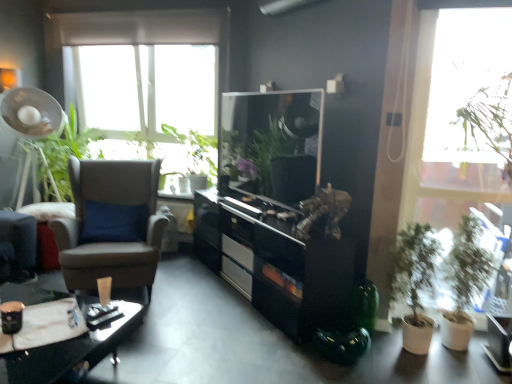
Question: From a real-world perspective, is green leafy plant at upper center, which is the 1th vegetation from right to left, located beneath brown leather chair at left?

Choices:
 (A) no
 (B) yes

Answer: (A)

Question: Does green leafy plant at upper center, which is the 1th vegetation from right to left, have a larger size compared to brown leather chair at left?

Choices:
 (A) yes
 (B) no

Answer: (B)

Question: Is green leafy plant at upper center, arranged as the second vegetation when viewed from the left, outside brown leather chair at left?

Choices:
 (A) no
 (B) yes

Answer: (B)

Question: Is green leafy plant at upper center, arranged as the second vegetation when viewed from the left, in front of brown leather chair at left?

Choices:
 (A) yes
 (B) no

Answer: (B)

Question: Considering their positions, is brown leather chair at left located in front of or behind transparent glass window at upper right?

Choices:
 (A) behind
 (B) front

Answer: (A)

Question: Looking at their shapes, would you say brown leather chair at left is wider or thinner than transparent glass window at upper right?

Choices:
 (A) wide
 (B) thin

Answer: (A)

Question: Is brown leather chair at left bigger or smaller than transparent glass window at upper right?

Choices:
 (A) big
 (B) small

Answer: (A)

Question: From the image's perspective, relative to transparent glass window at upper right, is brown leather chair at left above or below?

Choices:
 (A) above
 (B) below

Answer: (B)

Question: From the image's perspective, is green matte plant at right, the 1th houseplant when ordered from left to right, located above or below green matte plant at right, which is counted as the first houseplant, starting from the right?

Choices:
 (A) above
 (B) below

Answer: (B)

Question: Is green matte plant at right, placed as the 2th houseplant when sorted from right to left, inside or outside of green matte plant at right, marked as the 2th houseplant in a left-to-right arrangement?

Choices:
 (A) outside
 (B) inside

Answer: (A)

Question: From a real-world perspective, relative to green matte plant at right, marked as the 2th houseplant in a left-to-right arrangement, is green matte plant at right, the 1th houseplant when ordered from left to right, vertically above or below?

Choices:
 (A) below
 (B) above

Answer: (A)

Question: In the image, is green matte plant at right, the 1th houseplant when ordered from left to right, positioned in front of or behind green matte plant at right, marked as the 2th houseplant in a left-to-right arrangement?

Choices:
 (A) front
 (B) behind

Answer: (A)

Question: Considering the relative positions of green matte plant at right, marked as the 2th houseplant in a left-to-right arrangement, and green leafy plant at left, the 1th vegetation from the left, in the image provided, is green matte plant at right, marked as the 2th houseplant in a left-to-right arrangement, to the left or to the right of green leafy plant at left, the 1th vegetation from the left,?

Choices:
 (A) right
 (B) left

Answer: (A)

Question: Is point (477, 218) positioned closer to the camera than point (55, 152)?

Choices:
 (A) farther
 (B) closer

Answer: (B)